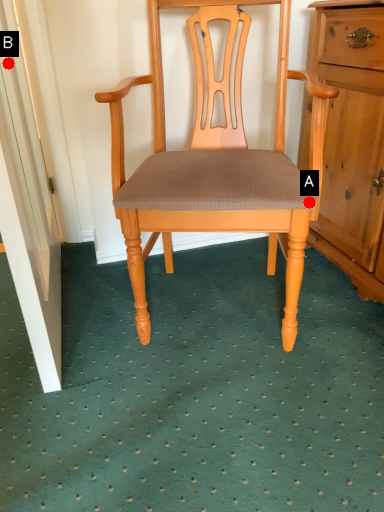
Question: Two points are circled on the image, labeled by A and B beside each circle. Which of the following is the closest to the observer?

Choices:
 (A) A is closer
 (B) B is closer

Answer: (A)